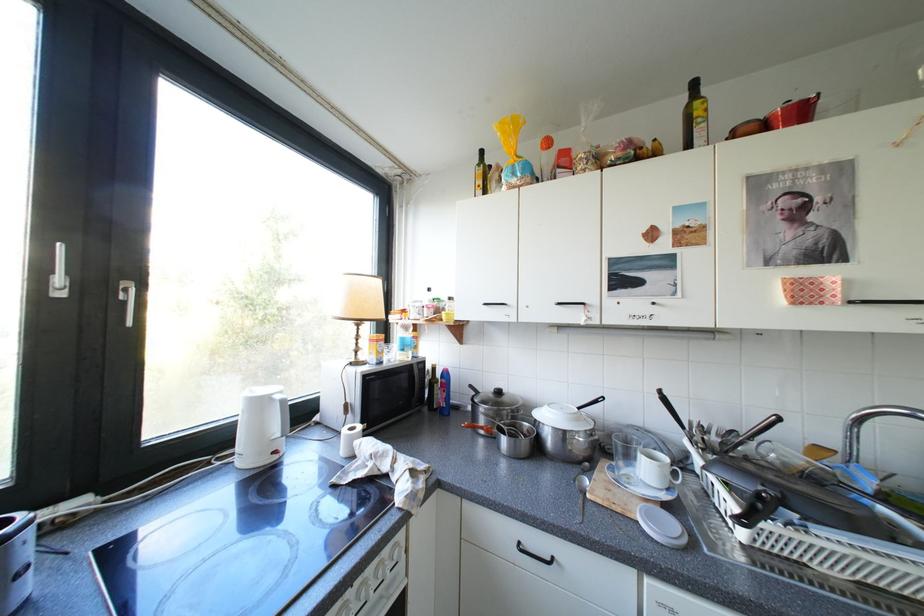
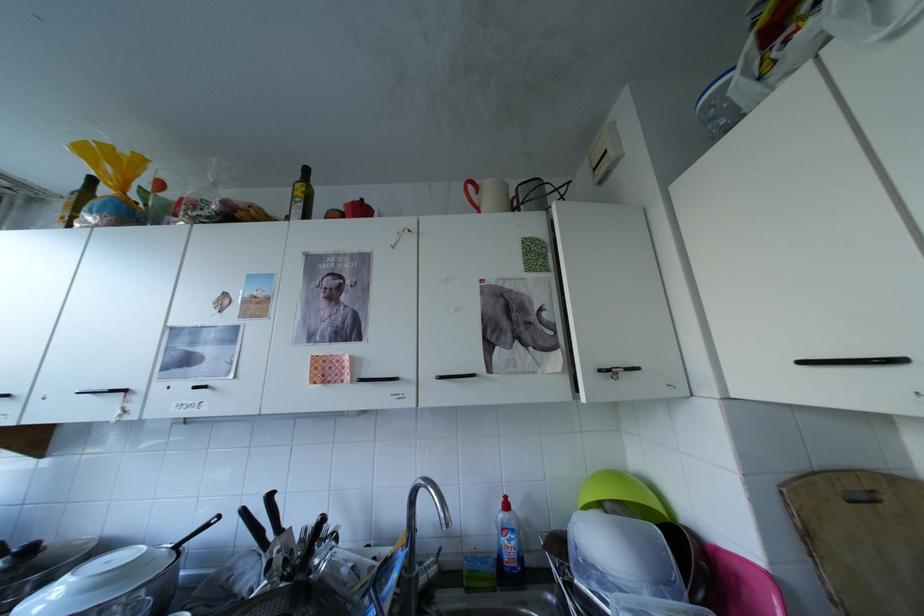
Find the pixel in the second image that matches [709,114] in the first image.

(309, 193)